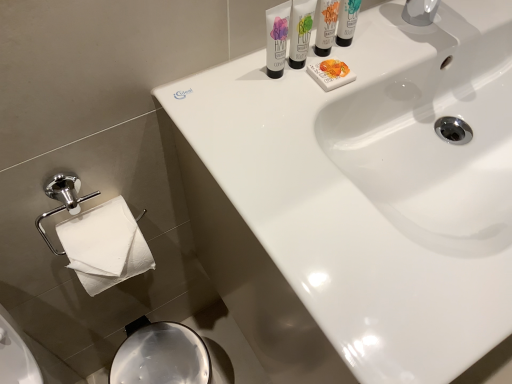
You are a GUI agent. You are given a task and a screenshot of the screen. Output one action in this format:
    pyautogui.click(x=<x>, y=<y>)
    Task: Click on the free location in front of white glossy tube at upper center, arranged as the 1th shaving cream when viewed from the left
    
    Given the screenshot: What is the action you would take?
    pyautogui.click(x=280, y=162)